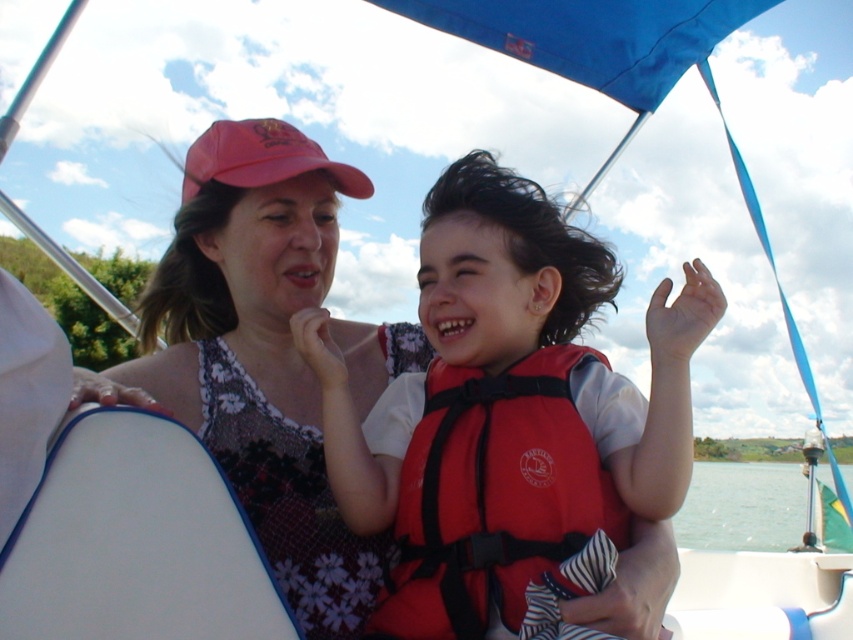
Question: Is red matte life vest at center behind clear water at lower right?

Choices:
 (A) yes
 (B) no

Answer: (B)

Question: Which of these objects is positioned farthest from the matte pink cap at upper center?

Choices:
 (A) clear water at lower right
 (B) red matte baseball cap at upper center
 (C) red matte life vest at center

Answer: (A)

Question: Considering the real-world distances, which object is closest to the matte pink cap at upper center?

Choices:
 (A) red fabric life jacket at center
 (B) clear water at lower right
 (C) red matte baseball cap at upper center

Answer: (C)

Question: Does matte pink cap at upper center have a smaller size compared to red matte baseball cap at upper center?

Choices:
 (A) no
 (B) yes

Answer: (A)

Question: Which point is closer to the camera taking this photo?

Choices:
 (A) (544, 552)
 (B) (799, 470)
 (C) (222, 278)
 (D) (390, 632)

Answer: (A)

Question: Can you confirm if red matte life vest at center is smaller than red matte baseball cap at upper center?

Choices:
 (A) yes
 (B) no

Answer: (B)